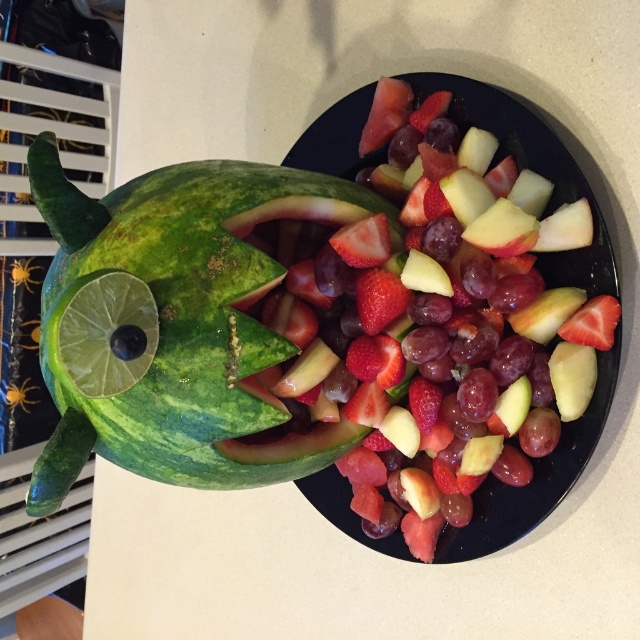
Question: Does green striped watermelon at left appear on the right side of glossy ceramic platter at center?

Choices:
 (A) no
 (B) yes

Answer: (A)

Question: Does green striped watermelon at left appear on the left side of glossy ceramic platter at center?

Choices:
 (A) no
 (B) yes

Answer: (B)

Question: Is green striped watermelon at left wider than glossy ceramic platter at center?

Choices:
 (A) no
 (B) yes

Answer: (B)

Question: Among these points, which one is nearest to the camera?

Choices:
 (A) (243, 170)
 (B) (516, 120)

Answer: (A)

Question: Among these points, which one is nearest to the camera?

Choices:
 (A) (72, 340)
 (B) (454, 108)

Answer: (A)

Question: Among these points, which one is nearest to the camera?

Choices:
 (A) (230, 444)
 (B) (512, 132)

Answer: (A)